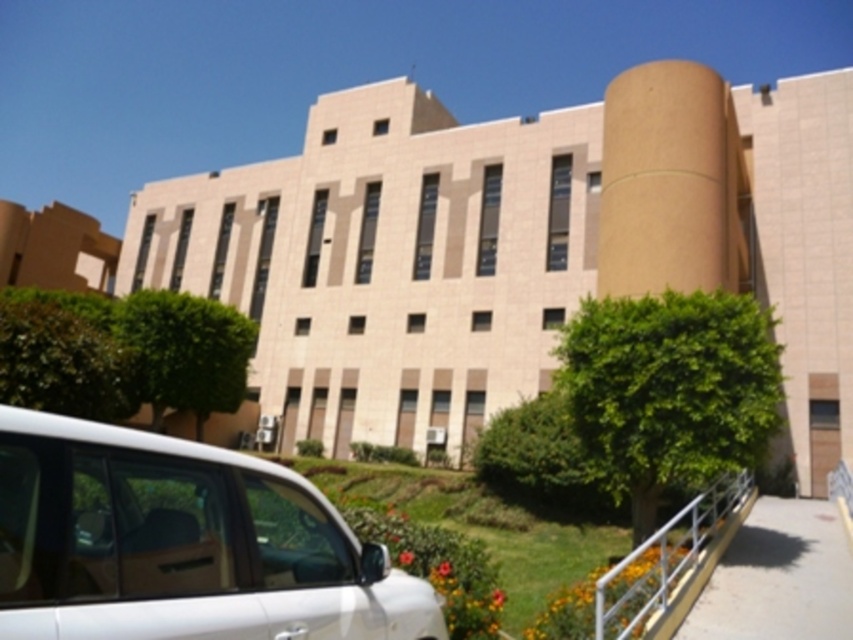
Can you confirm if white matte van at lower left is smaller than white metal railing at lower right?

Yes.

What do you see at coordinates (181, 544) in the screenshot? This screenshot has width=853, height=640. I see `white matte van at lower left` at bounding box center [181, 544].

Where is `white matte van at lower left`? white matte van at lower left is located at coordinates (181, 544).